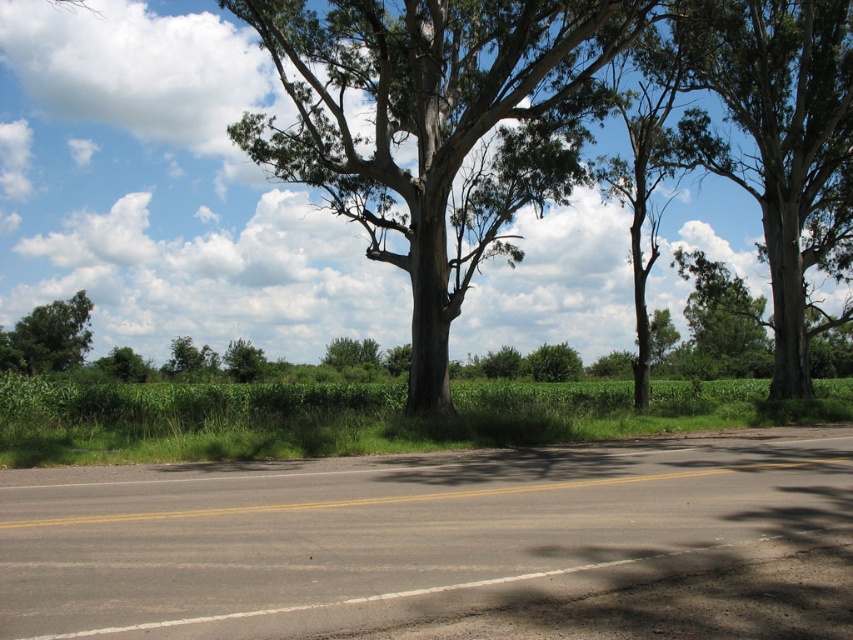
Question: Which point is farther from the camera taking this photo?

Choices:
 (A) (242, 346)
 (B) (64, 360)
 (C) (720, 134)

Answer: (A)

Question: Does green rough bark tree at upper right have a larger size compared to green leafy tree at upper right?

Choices:
 (A) no
 (B) yes

Answer: (B)

Question: Which is farther from the green rough bark tree at center?

Choices:
 (A) green matte tree at center
 (B) green leafy tree at left

Answer: (B)

Question: Is green rough bark tree at upper right wider than green leafy tree at lower left?

Choices:
 (A) no
 (B) yes

Answer: (B)

Question: From the image, what is the correct spatial relationship of green rough bark tree at center in relation to green matte tree at center?

Choices:
 (A) left
 (B) right

Answer: (B)

Question: Which object is farther from the camera taking this photo?

Choices:
 (A) green rough bark tree at upper right
 (B) green leafy tree at upper right
 (C) green rough bark tree at center

Answer: (B)